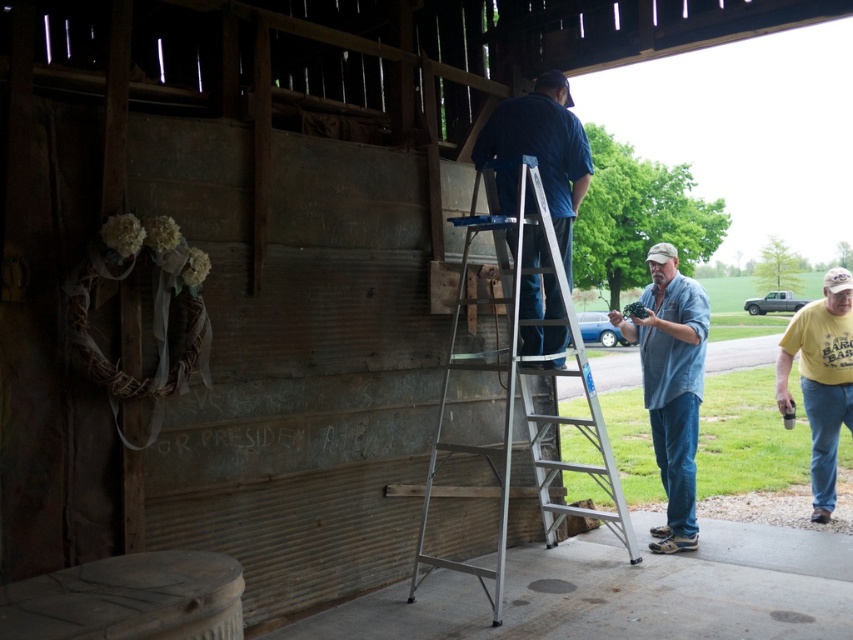
Between silver metallic ladder at center and denim shirt at center, which one has more height?

With more height is silver metallic ladder at center.

I want to click on silver metallic ladder at center, so click(521, 406).

I want to click on silver metallic ladder at center, so click(x=521, y=406).

Who is positioned more to the right, blue fabric shirt at upper center or denim shirt at center?

denim shirt at center

I want to click on blue fabric shirt at upper center, so click(538, 154).

In the scene shown: Does blue fabric shirt at upper center have a lesser width compared to yellow t-shirt at right?

No, blue fabric shirt at upper center is not thinner than yellow t-shirt at right.

You are a GUI agent. You are given a task and a screenshot of the screen. Output one action in this format:
    pyautogui.click(x=<x>, y=<y>)
    Task: Click on the blue fabric shirt at upper center
    Image resolution: width=853 pixels, height=640 pixels.
    Given the screenshot: What is the action you would take?
    pyautogui.click(x=538, y=154)